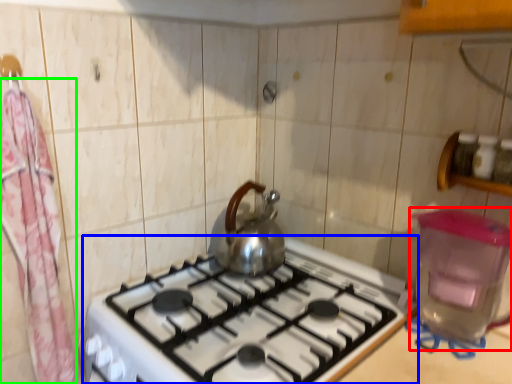
Question: Estimate the real-world distances between objects in this image. Which object is farther from water heater (highlighted by a red box), gas stove (highlighted by a blue box) or curtain (highlighted by a green box)?

Choices:
 (A) gas stove
 (B) curtain

Answer: (B)